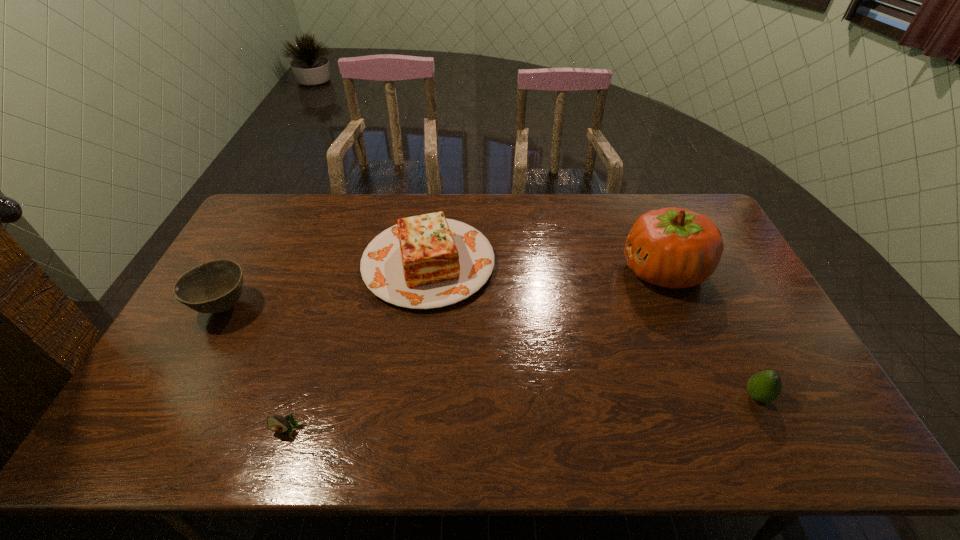
The image size is (960, 540). Identify the location of vacant space at the left edge of the desktop. (204, 383).

Locate an element on the screen. unoccupied area between the leftmost object and the left avocado is located at coordinates (256, 369).

Identify the location of free spot between the farther avocado and the bowl. The height and width of the screenshot is (540, 960). (491, 352).

You are a GUI agent. You are given a task and a screenshot of the screen. Output one action in this format:
    pyautogui.click(x=<x>, y=<y>)
    Task: Click on the unoccupied area between the bowl and the taller avocado
    Image resolution: width=960 pixels, height=540 pixels.
    Given the screenshot: What is the action you would take?
    pyautogui.click(x=491, y=352)

Identify the location of free spot between the lasagna and the tallest object. The image size is (960, 540). (546, 267).

Locate an element on the screen. free space between the fourth object from right to left and the farther avocado is located at coordinates (522, 413).

Locate an element on the screen. vacant region between the lasagna and the leftmost object is located at coordinates (326, 285).

Locate an element on the screen. This screenshot has width=960, height=540. vacant space that is in between the fourth object from right to left and the tallest object is located at coordinates (476, 351).

At what (x,y) coordinates should I click in order to perform the action: click on empty space between the pumpkin and the shortest object. Please return your answer as a coordinate pair (x, y). Image resolution: width=960 pixels, height=540 pixels. Looking at the image, I should click on (476, 351).

Find the location of a particular element. The width and height of the screenshot is (960, 540). unoccupied position between the shortest object and the pumpkin is located at coordinates (476, 351).